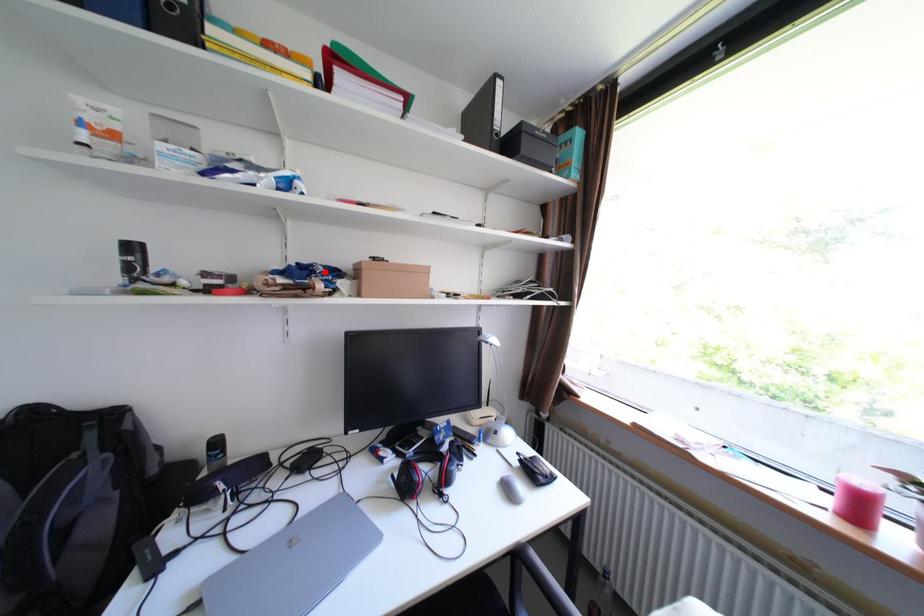
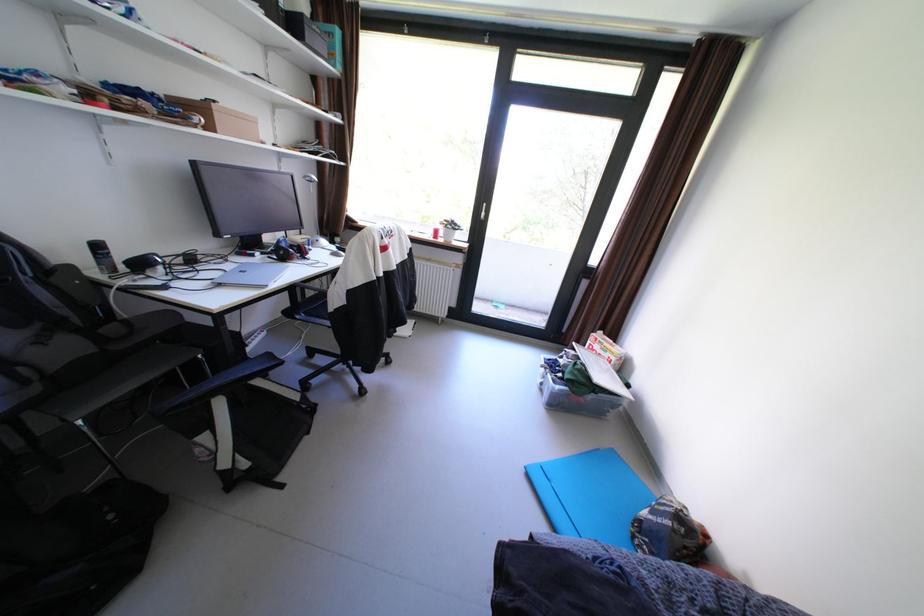
Locate, in the second image, the point that corresponds to the highlighted location in the first image.

(172, 100)